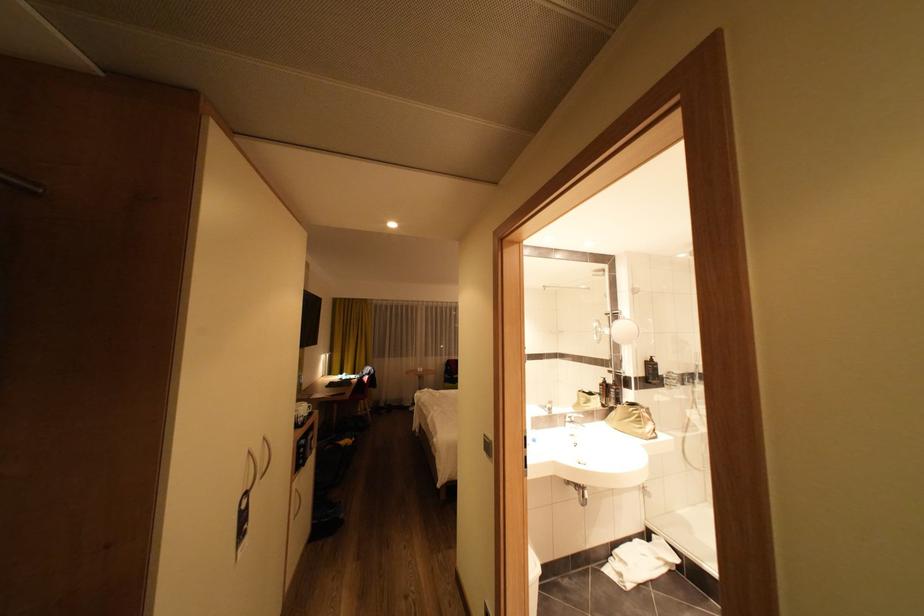
Which object does [650,371] point to?

It corresponds to the black bottle in the image.